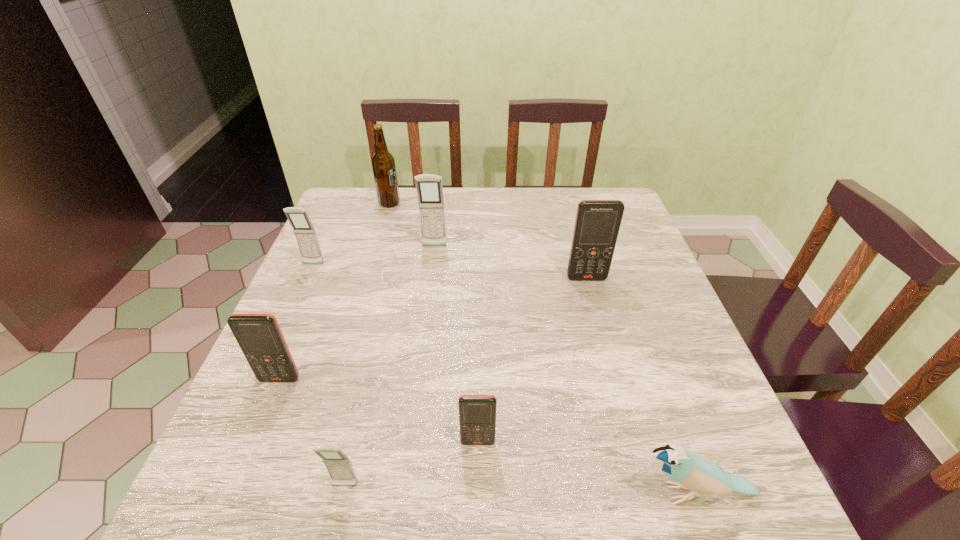
Locate an element on the screen. This screenshot has width=960, height=540. beer bottle is located at coordinates (383, 163).

I want to click on the farthest object, so click(x=383, y=163).

At what (x,y) coordinates should I click in order to perform the action: click on the second farthest object. Please return your answer as a coordinate pair (x, y). The image size is (960, 540). Looking at the image, I should click on (429, 188).

Find the location of a particular element. the farthest gray cellular telephone is located at coordinates (429, 188).

Find the location of a particular element. The width and height of the screenshot is (960, 540). the rightmost orange cellular telephone is located at coordinates (597, 223).

Image resolution: width=960 pixels, height=540 pixels. I want to click on the third farthest cellular telephone, so click(x=597, y=223).

The width and height of the screenshot is (960, 540). Find the location of `the second smallest gray cellular telephone`. the second smallest gray cellular telephone is located at coordinates (304, 232).

Where is `the second nearest gray cellular telephone`? This screenshot has width=960, height=540. the second nearest gray cellular telephone is located at coordinates (304, 232).

Identify the location of the third nearest cellular telephone. This screenshot has height=540, width=960. (259, 336).

You are a GUI agent. You are given a task and a screenshot of the screen. Output one action in this format:
    pyautogui.click(x=<x>, y=<y>)
    Task: Click on the second biggest orange cellular telephone
    The image size is (960, 540).
    Given the screenshot: What is the action you would take?
    pyautogui.click(x=259, y=336)